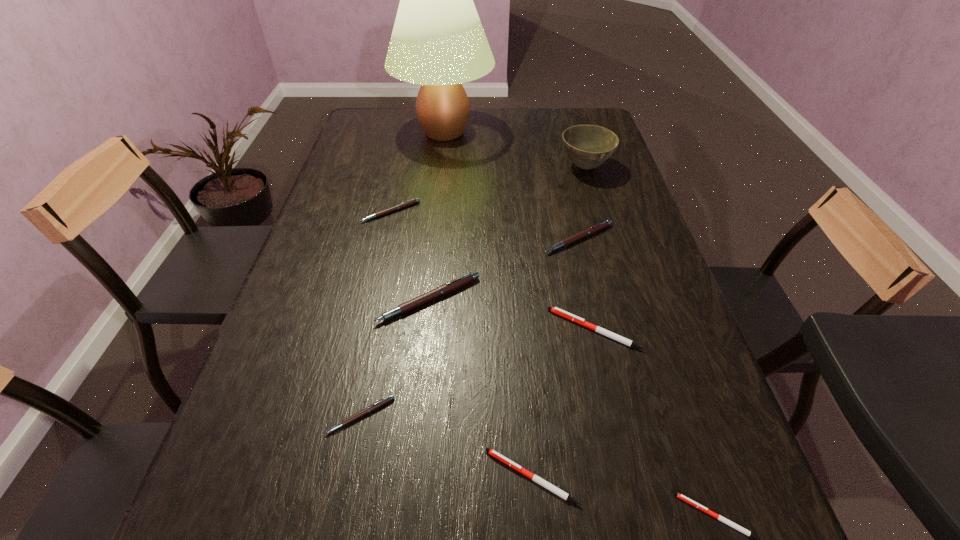
Image resolution: width=960 pixels, height=540 pixels. In the image, there is a desktop. In order to click on vacant space at the left edge in this screenshot , I will do `click(348, 246)`.

Identify the location of vacant area at the right edge. The image size is (960, 540). (579, 180).

This screenshot has height=540, width=960. What are the coordinates of `vacant area at the far left corner` in the screenshot? It's located at (392, 118).

I want to click on free space that is in between the bowl and the nearest pink pen, so click(x=473, y=291).

You are a GUI agent. You are given a task and a screenshot of the screen. Output one action in this format:
    pyautogui.click(x=<x>, y=<y>)
    Task: Click on the free space between the second nearest pink pen and the eighth shortest object
    The image size is (960, 540).
    Given the screenshot: What is the action you would take?
    pyautogui.click(x=507, y=233)

Where is `unoccupied area between the farthest white pen and the second biggest white pen`? This screenshot has width=960, height=540. unoccupied area between the farthest white pen and the second biggest white pen is located at coordinates (564, 403).

Where is `vacant area that lies between the second biggest white pen and the biggest white pen`? The image size is (960, 540). vacant area that lies between the second biggest white pen and the biggest white pen is located at coordinates (564, 403).

Locate an element on the screen. The image size is (960, 540). free space between the sixth shortest object and the third biggest pink pen is located at coordinates (485, 225).

At what (x,y) coordinates should I click in order to perform the action: click on vacant area that lies between the biggest pink pen and the second tallest object. Please return your answer as a coordinate pair (x, y). Looking at the image, I should click on tap(507, 233).

This screenshot has height=540, width=960. Identify the location of free space between the nearest pink pen and the third biggest pink pen. (376, 313).